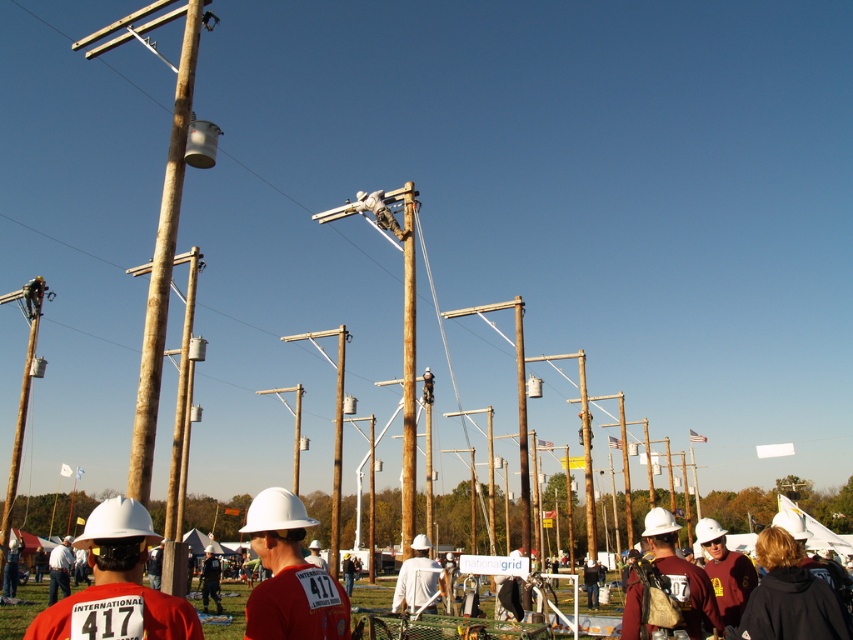
You are a participant in the utility pole climbing competition and you want to locate your team member wearing the matte maroon shirt at lower right. Where should you look in the image?

You should look at point (724, 572) in the image to find the matte maroon shirt at lower right.

You are organizing a safety inspection and need to ensure all hard hats meet the minimum width requirement of 20 cm. You observe two hard hats in the scene. Which hard hat, the matte white hard hat at lower right or the white hard hat at center, is more likely to meet the requirement based on their sizes?

The white hard hat at center is more likely to meet the minimum width requirement since it has a greater width than the matte white hard hat at lower right.